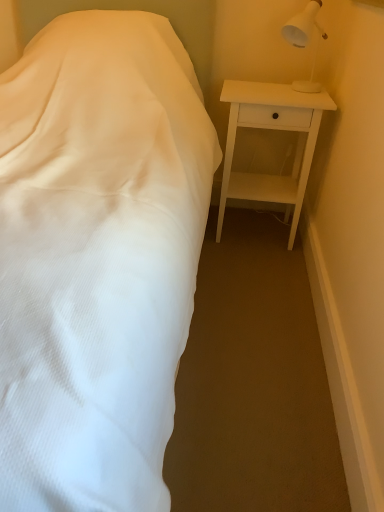
Question: Considering the relative sizes of white plastic lamp at upper right and white matte nightstand at right in the image provided, is white plastic lamp at upper right smaller than white matte nightstand at right?

Choices:
 (A) yes
 (B) no

Answer: (A)

Question: Is white plastic lamp at upper right to the right of white matte nightstand at right from the viewer's perspective?

Choices:
 (A) yes
 (B) no

Answer: (A)

Question: From a real-world perspective, is white plastic lamp at upper right on top of white matte nightstand at right?

Choices:
 (A) no
 (B) yes

Answer: (B)

Question: Is white plastic lamp at upper right not inside white matte nightstand at right?

Choices:
 (A) yes
 (B) no

Answer: (A)

Question: From a real-world perspective, is white plastic lamp at upper right beneath white matte nightstand at right?

Choices:
 (A) no
 (B) yes

Answer: (A)

Question: Does white plastic lamp at upper right have a lesser width compared to white matte nightstand at right?

Choices:
 (A) yes
 (B) no

Answer: (A)

Question: Are white matte nightstand at right and white plastic lamp at upper right making contact?

Choices:
 (A) yes
 (B) no

Answer: (B)

Question: Is white matte nightstand at right thinner than white plastic lamp at upper right?

Choices:
 (A) no
 (B) yes

Answer: (A)

Question: Is white matte nightstand at right outside of white plastic lamp at upper right?

Choices:
 (A) yes
 (B) no

Answer: (A)

Question: Can you confirm if white matte nightstand at right is wider than white plastic lamp at upper right?

Choices:
 (A) no
 (B) yes

Answer: (B)

Question: Is white matte nightstand at right bigger than white plastic lamp at upper right?

Choices:
 (A) no
 (B) yes

Answer: (B)

Question: Can you confirm if white matte nightstand at right is smaller than white plastic lamp at upper right?

Choices:
 (A) yes
 (B) no

Answer: (B)

Question: From their relative heights in the image, would you say white plastic lamp at upper right is taller or shorter than white matte nightstand at right?

Choices:
 (A) tall
 (B) short

Answer: (B)